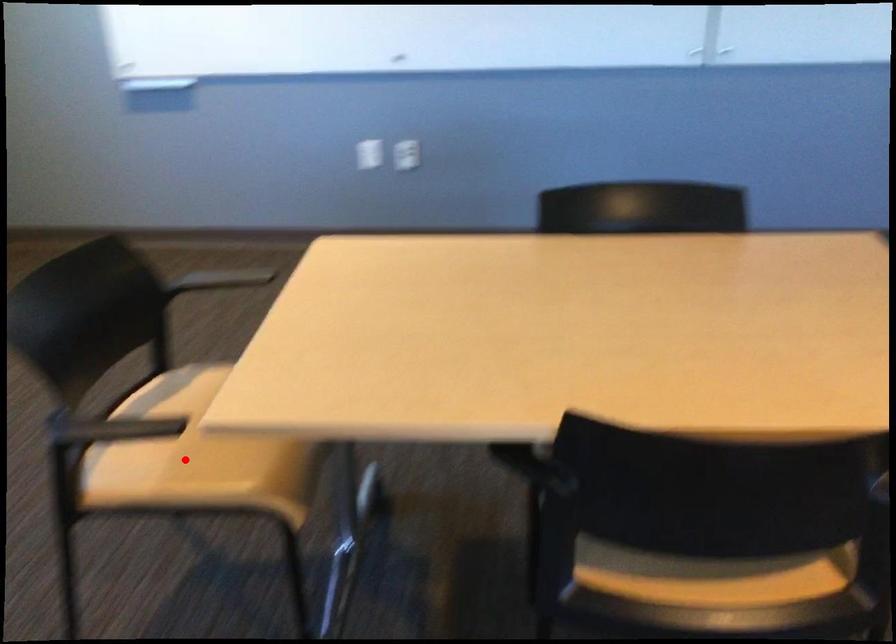
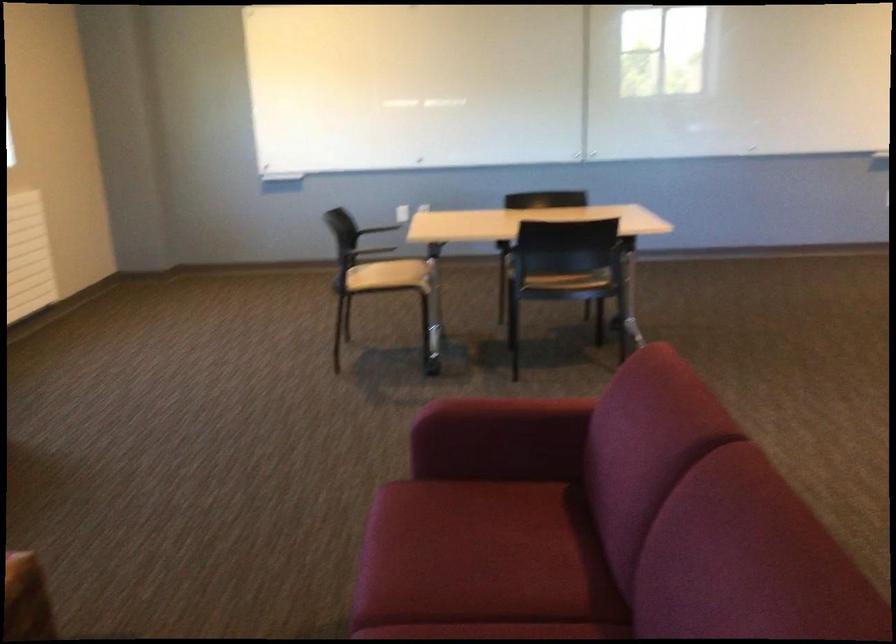
The point at the highlighted location is marked in the first image. Where is the corresponding point in the second image?

(389, 276)